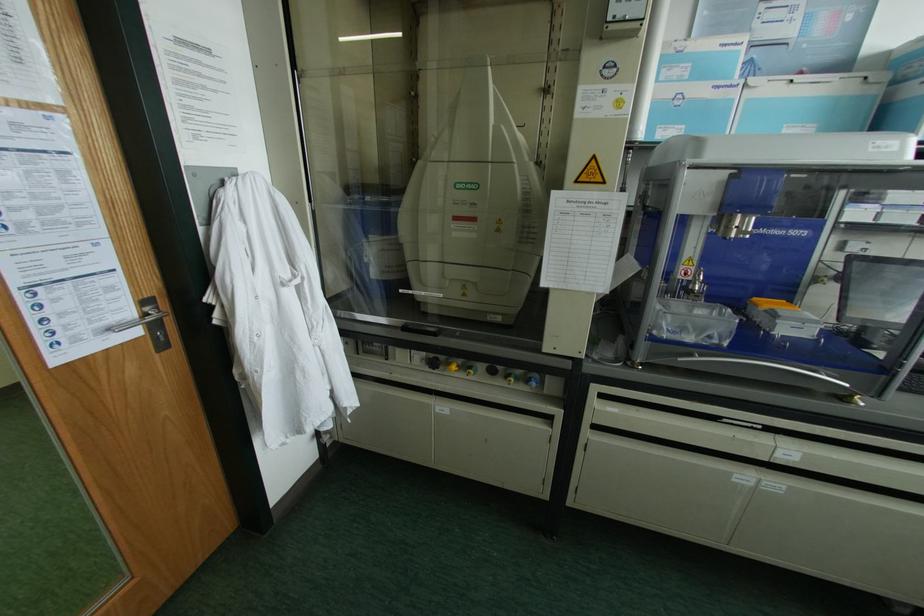
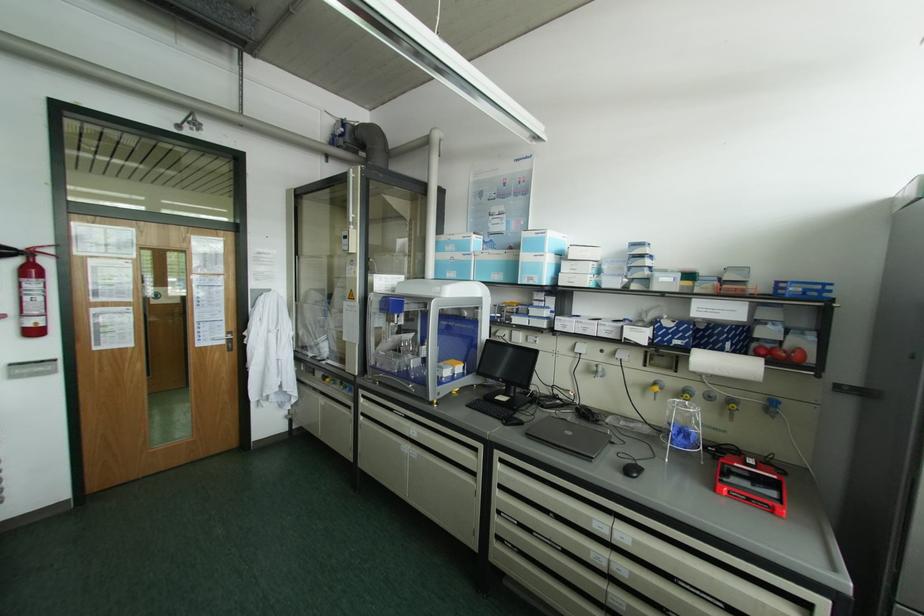
Where in the second image is the point corresponding to (x=138, y=331) from the first image?

(224, 342)